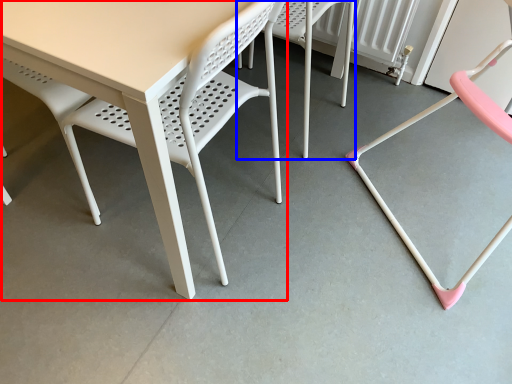
Question: Which object appears closest to the camera in this image, table (highlighted by a red box) or chair (highlighted by a blue box)?

Choices:
 (A) table
 (B) chair

Answer: (A)